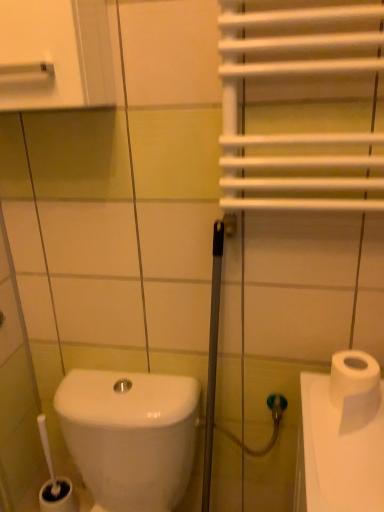
Question: Is white matte toilet paper at right bigger or smaller than white glossy toilet at lower left?

Choices:
 (A) big
 (B) small

Answer: (B)

Question: Is point (349, 396) closer or farther from the camera than point (77, 466)?

Choices:
 (A) closer
 (B) farther

Answer: (A)

Question: Which is farther from the white glossy toilet at lower left?

Choices:
 (A) white matte toilet paper at right
 (B) white glossy medicine cabinet at upper left

Answer: (B)

Question: Considering the real-world distances, which object is farthest from the white glossy toilet at lower left?

Choices:
 (A) white matte toilet paper at right
 (B) white glossy medicine cabinet at upper left

Answer: (B)